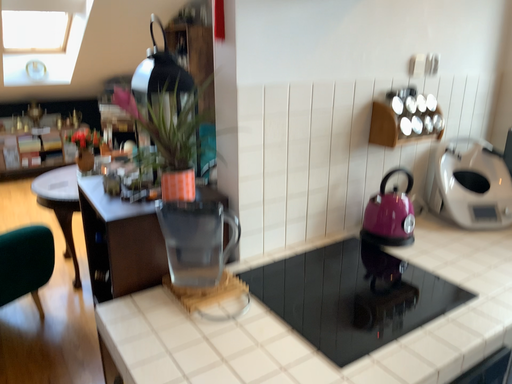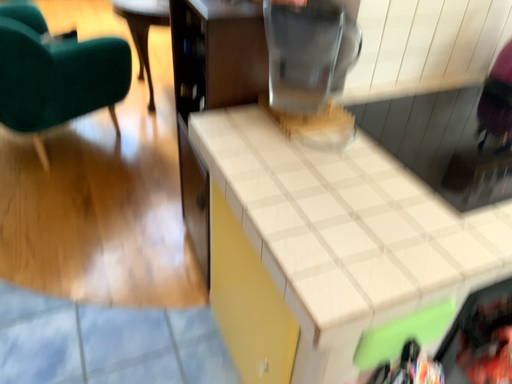
Question: How did the camera likely rotate when shooting the video?

Choices:
 (A) rotated downward
 (B) rotated upward

Answer: (A)